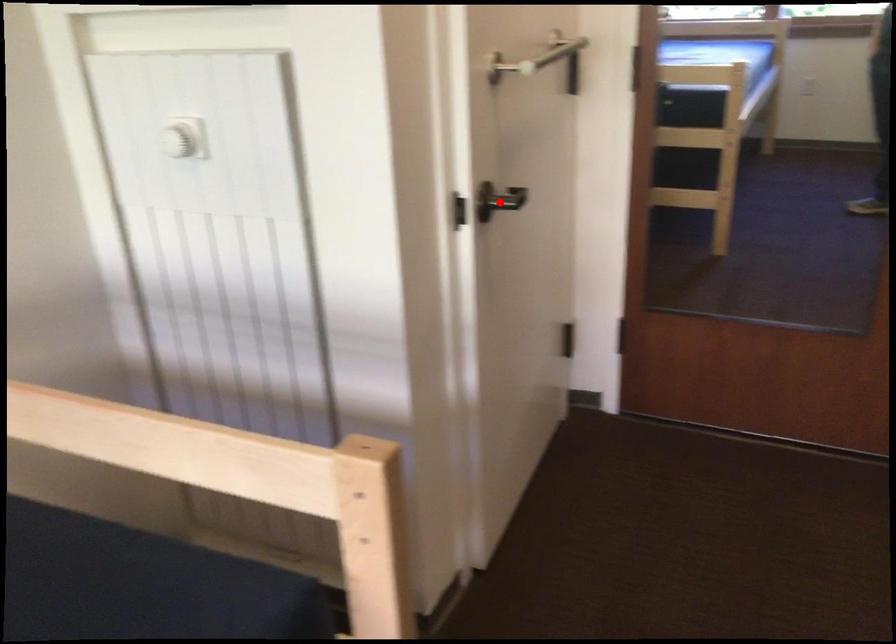
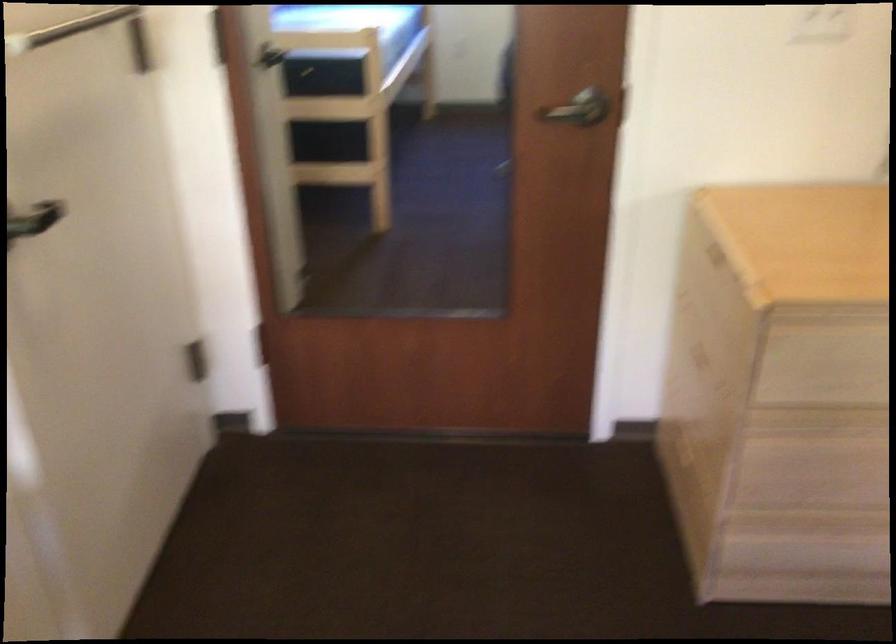
The point at the highlighted location is marked in the first image. Where is the corresponding point in the second image?

(35, 219)